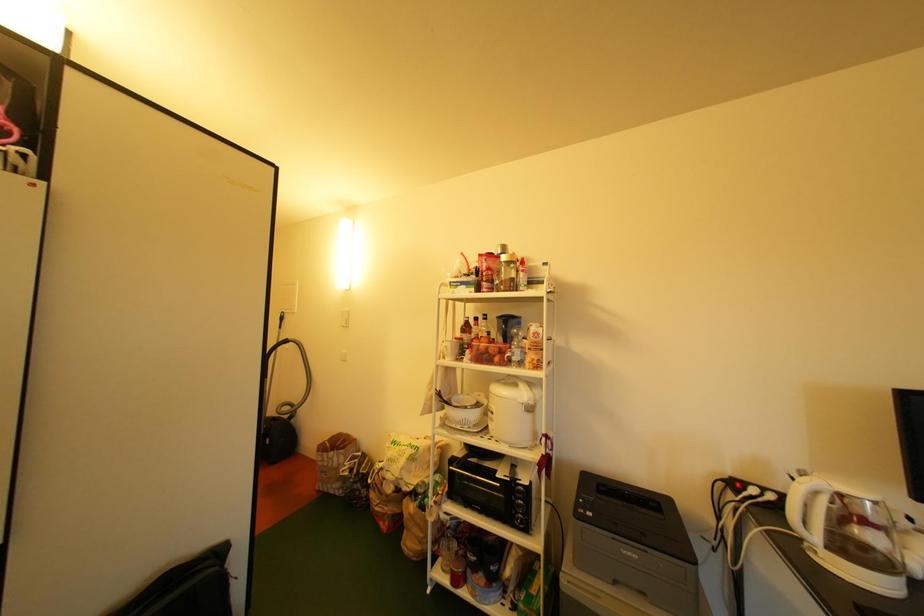
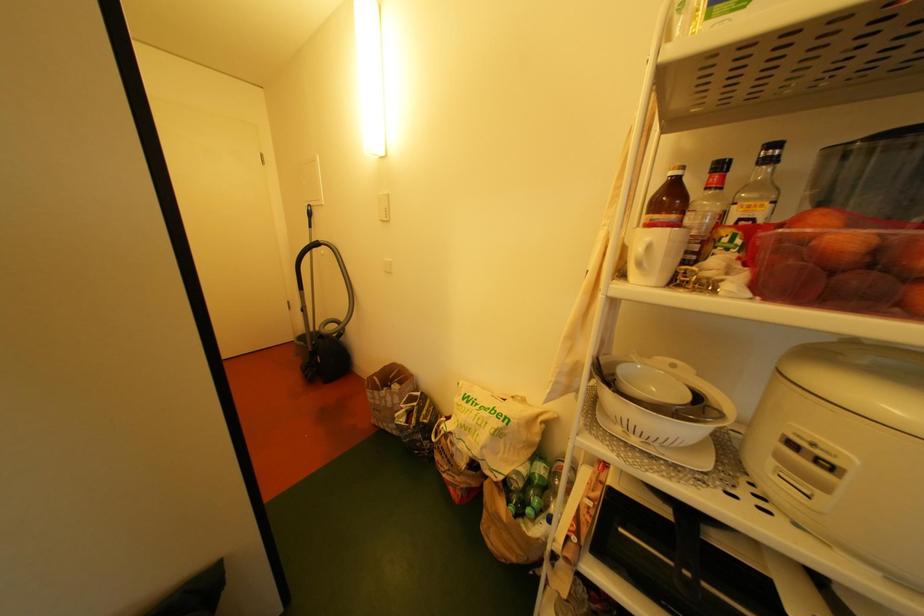
Question: How did the camera likely rotate?

Choices:
 (A) Left
 (B) Right
 (C) Up
 (D) Down

Answer: (D)